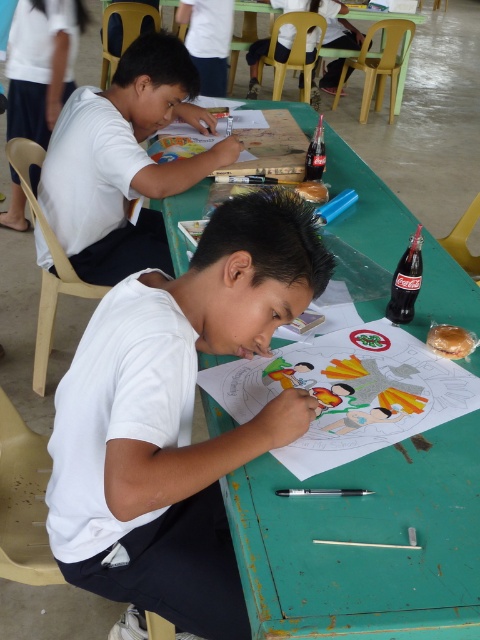
You are a teacher observing the classroom scene. You notice the white paper at center and the green painted wood table at center. Which object is closer to you?

The white paper at center is closer to you because the green painted wood table at center is behind it.

You are a teacher observing the classroom scene. You notice the white paper at center. Can you determine its exact position using the coordinate system provided?

The white paper at center is located at point (177, 417) according to the coordinate system provided.